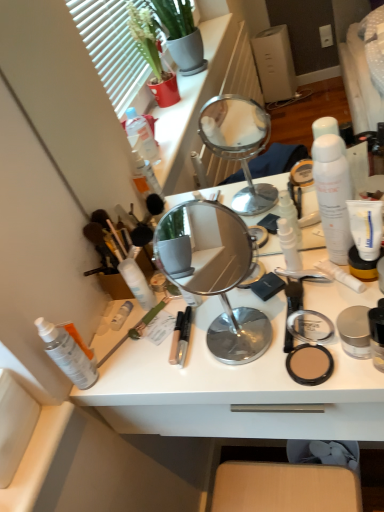
Locate an element on the screen. The width and height of the screenshot is (384, 512). vacant area located to the right-hand side of transparent plastic spray bottle at lower left, the 1th toiletry from the left is located at coordinates click(x=167, y=353).